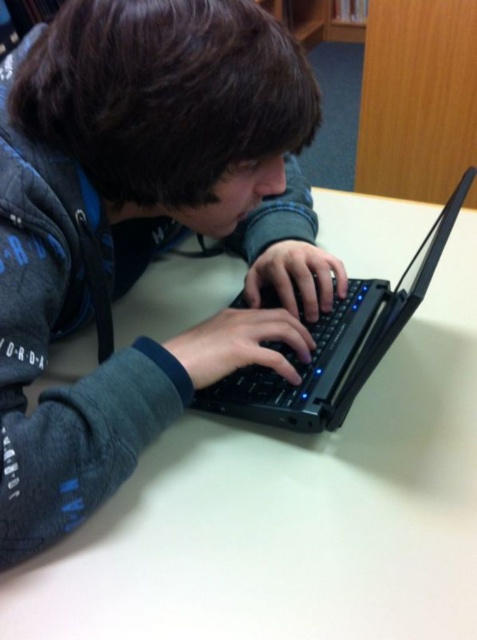
Is point (89, 547) more distant than point (468, 168)?

That is False.

The width and height of the screenshot is (477, 640). What do you see at coordinates (292, 512) in the screenshot?
I see `white matte table at center` at bounding box center [292, 512].

Locate an element on the screen. This screenshot has height=640, width=477. white matte table at center is located at coordinates (292, 512).